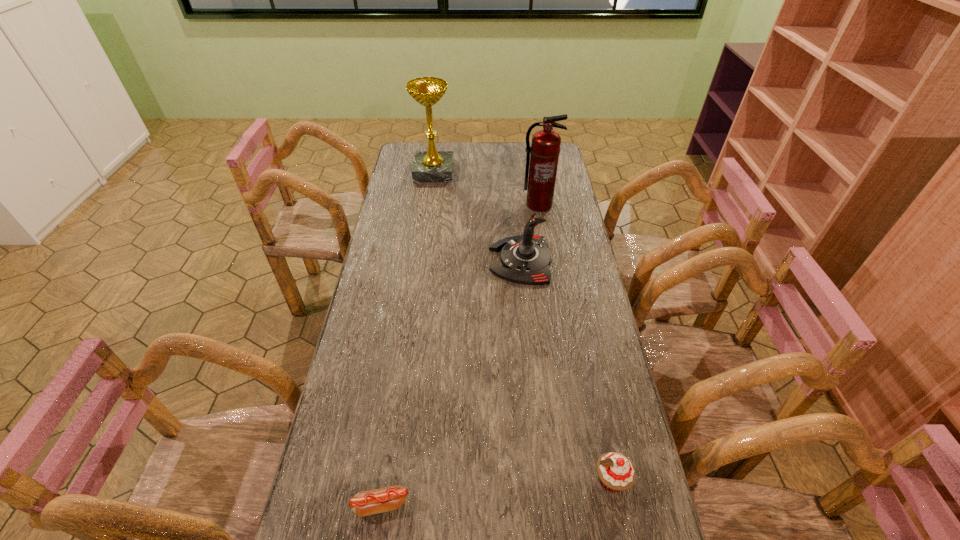
Find the location of `vacant space located 0.320m on the handle side of the joystick`. vacant space located 0.320m on the handle side of the joystick is located at coordinates (400, 260).

The height and width of the screenshot is (540, 960). Find the location of `vacant space situated on the left of the cupcake`. vacant space situated on the left of the cupcake is located at coordinates pyautogui.click(x=525, y=480).

The width and height of the screenshot is (960, 540). I want to click on free space located on the back of the sausage, so click(x=399, y=384).

The image size is (960, 540). I want to click on object located at the far edge, so click(x=429, y=166).

At what (x,y) coordinates should I click in order to perform the action: click on award located in the left edge section of the desktop. Please return your answer as a coordinate pair (x, y). Looking at the image, I should click on [429, 166].

At what (x,y) coordinates should I click in order to perform the action: click on sausage positioned at the left edge. Please return your answer as a coordinate pair (x, y). Looking at the image, I should click on (364, 503).

Where is `fire extinguisher located in the right edge section of the desktop`? The image size is (960, 540). fire extinguisher located in the right edge section of the desktop is located at coordinates (545, 147).

This screenshot has width=960, height=540. I want to click on joystick present at the right edge, so pos(525,259).

Find the location of `cupcake at the right edge`. cupcake at the right edge is located at coordinates (616, 472).

Identify the location of object located in the far left corner section of the desktop. (429, 166).